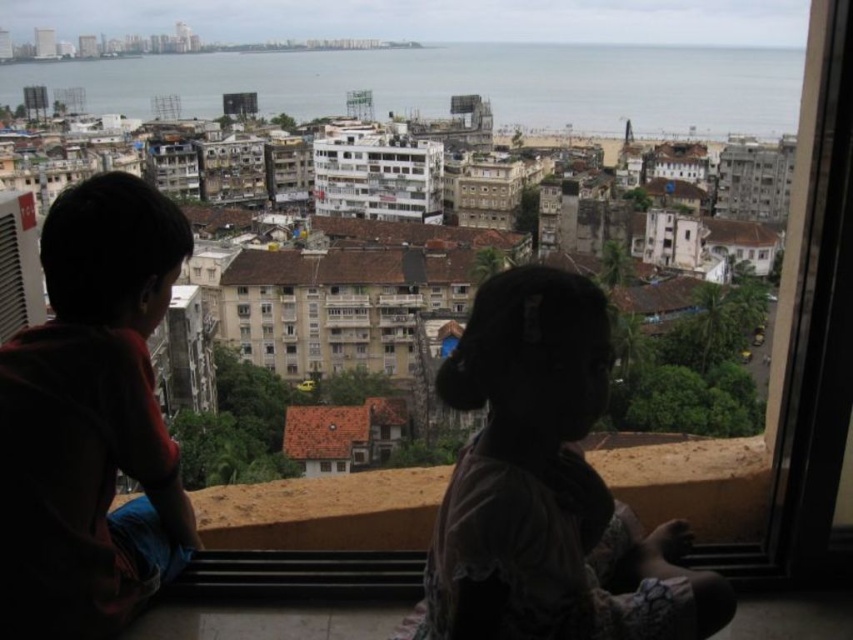
Question: Is silhouette fabric at center above transparent glass window at center?

Choices:
 (A) no
 (B) yes

Answer: (A)

Question: Among these objects, which one is nearest to the camera?

Choices:
 (A) dark red t-shirt at left
 (B) silhouette fabric at center
 (C) transparent glass window at center

Answer: (B)

Question: Can you confirm if dark red t-shirt at left is thinner than transparent glass window at center?

Choices:
 (A) no
 (B) yes

Answer: (A)

Question: Does dark red t-shirt at left have a lesser width compared to silhouette fabric at center?

Choices:
 (A) no
 (B) yes

Answer: (A)

Question: Among these points, which one is farthest from the camera?

Choices:
 (A) (572, 428)
 (B) (247, 312)
 (C) (94, 528)

Answer: (B)

Question: Among these points, which one is farthest from the camera?

Choices:
 (A) (248, 307)
 (B) (35, 476)
 (C) (444, 627)

Answer: (A)